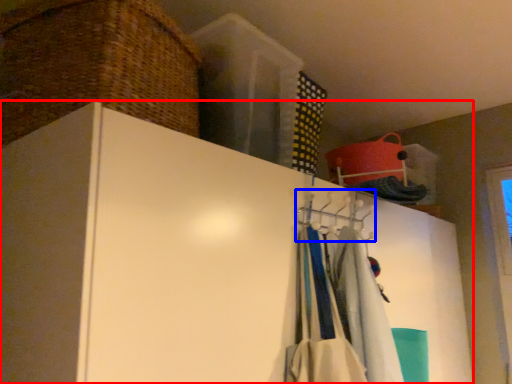
Question: Which object is closer to the camera taking this photo, cupboard (highlighted by a red box) or hanger (highlighted by a blue box)?

Choices:
 (A) cupboard
 (B) hanger

Answer: (A)